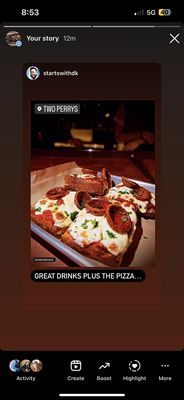
At what (x,y) coordinates should I click in order to perform the action: click on tray. Please return your answer as a coordinate pair (x, y). Looking at the image, I should click on (70, 255).